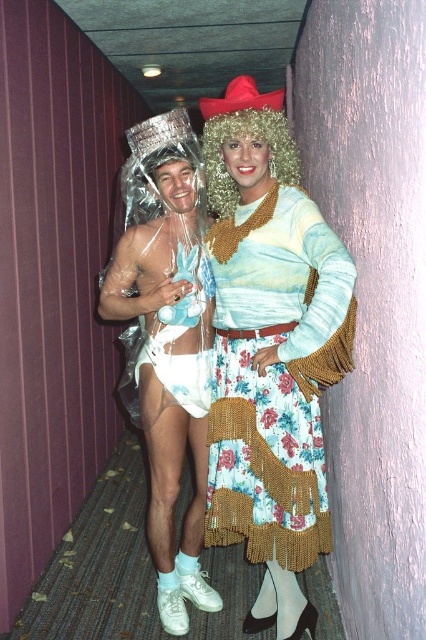
In the scene shown: You are a photographer trying to capture a photo of both shiny plastic wrap at center and shiny plastic wrap at left. The camera you are using has a maximum focus range of 12 inches. Can you focus on both objects at the same time?

The shiny plastic wrap at center is 11.73 inches away from the shiny plastic wrap at left. Since the distance between them is within the camera maximum focus range of 12 inches, you can focus on both objects at the same time.

You are standing in the hallway and need to reach the fuzzy blonde wig at center. Which direction should you move to get closer to it?

The fuzzy blonde wig at center is located at point 0.214 on the x axis and 0.589 on the y axis. To move closer, you should move towards the center of the hallway where the wig is positioned.

You are a photographer trying to capture a clear photo of both the shiny plastic wrap at center and the floral sequined skirt at center. Since the camera can only focus on one object at a time, which object should you focus on to ensure the other is still in the background? Explain your reasoning based on their distance apart.

Both the shiny plastic wrap at center and the floral sequined skirt at center are only 1.68 inches apart. Since they are very close to each other, focusing on either one will keep the other in the background with acceptable sharpness. However, if you focus on the shiny plastic wrap at center, the floral sequined skirt at center will be slightly more out of focus due to being farther away. Alternatively, focusing on the floral sequined skirt at center would keep the shiny plastic wrap at center slightly more